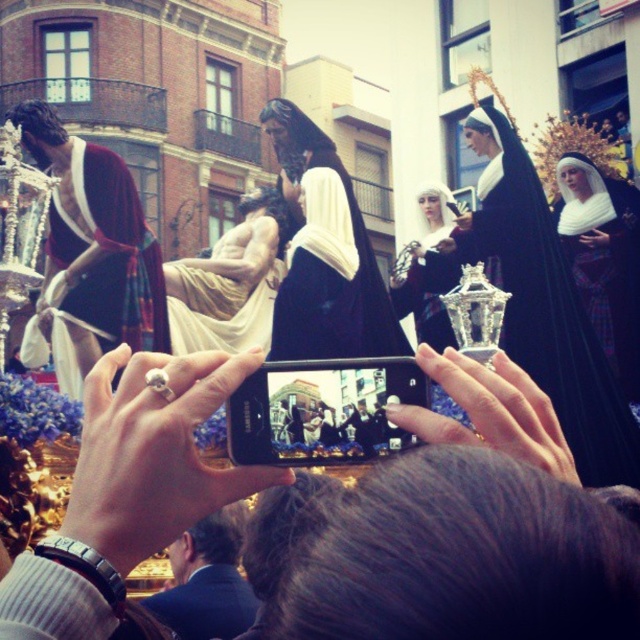
You are a photographer trying to capture the entire scene in your photo. You notice the black velvet nun at upper center and the matte black statue at left. Based on their positions, which one is closer to the bottom of the image?

The black velvet nun at upper center is below the matte black statue at left, so it is closer to the bottom of the image.

You are standing in the street scene and want to take a photo of the black velvet robe at center. Based on the phone screen preview, where should you aim your camera to capture the robe in the center of the photo?

The black velvet robe at center is located at point (324, 253), so you should aim your camera at that coordinate to center the robe in your photo.

You are a photographer trying to capture the entire scene of the religious procession. You notice the black velvet nun at upper center and the matte black statue at left. Which object is closer to the camera, and will it block the view of the other when taking the photo?

The black velvet nun at upper center is in front of the matte black statue at left, so it is closer to the camera and will block the view of the statue.